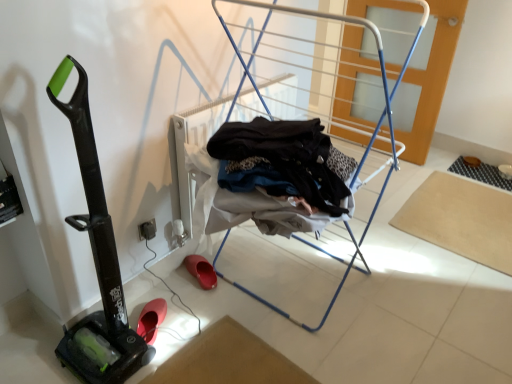
Locate an element on the screen. The height and width of the screenshot is (384, 512). vacant space that's between rubber/matte clog at lower left, the 1th footwear when ordered from top to bottom, and beige fabric yoga mat at lower right is located at coordinates (349, 241).